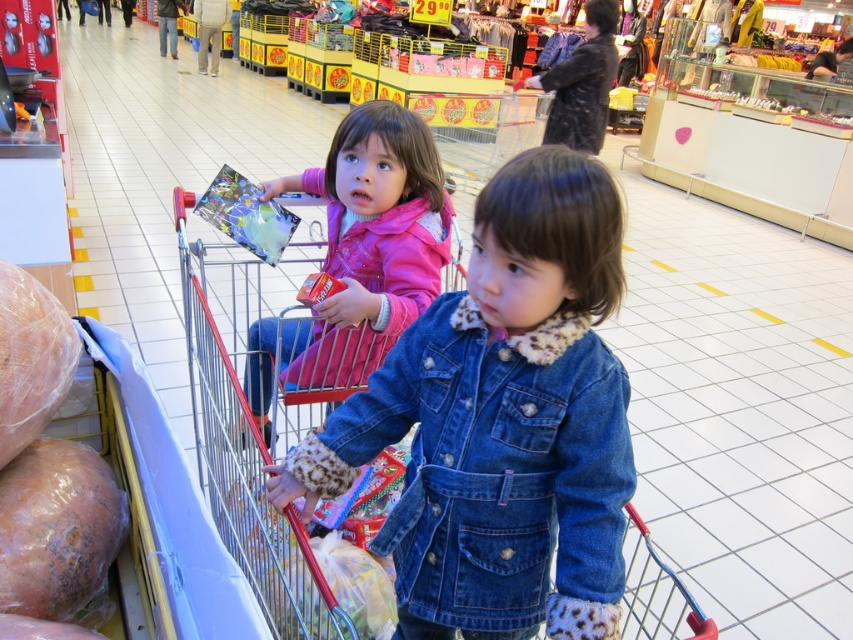
Can you confirm if pink fleece jacket at upper left is bigger than rotten plastic bag at lower left?

Yes.

Between pink fleece jacket at upper left and rotten plastic bag at lower left, which one has more height?

pink fleece jacket at upper left

Identify the location of pink fleece jacket at upper left. (358, 256).

Where is `pink fleece jacket at upper left`? The image size is (853, 640). pink fleece jacket at upper left is located at coordinates pos(358,256).

Does denim jacket at lower right have a smaller size compared to metallic red shopping cart at center?

Yes, denim jacket at lower right is smaller than metallic red shopping cart at center.

The image size is (853, 640). What are the coordinates of `denim jacket at lower right` in the screenshot? It's located at (494, 470).

What are the coordinates of `denim jacket at lower right` in the screenshot? It's located at (494, 470).

From the picture: Does denim jacket at lower right appear on the right side of pink fleece jacket at upper left?

Correct, you'll find denim jacket at lower right to the right of pink fleece jacket at upper left.

Does denim jacket at lower right have a greater width compared to pink fleece jacket at upper left?

No, denim jacket at lower right is not wider than pink fleece jacket at upper left.

Who is more forward, (544, 515) or (325, 362)?

Positioned in front is point (544, 515).

The height and width of the screenshot is (640, 853). Find the location of `denim jacket at lower right`. denim jacket at lower right is located at coordinates (494, 470).